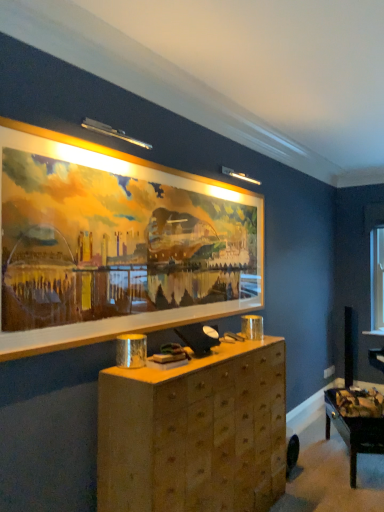
What are the coordinates of `empty space that is ontop of wooden picture frame at upper center (from a real-world perspective)` in the screenshot? It's located at [x=161, y=163].